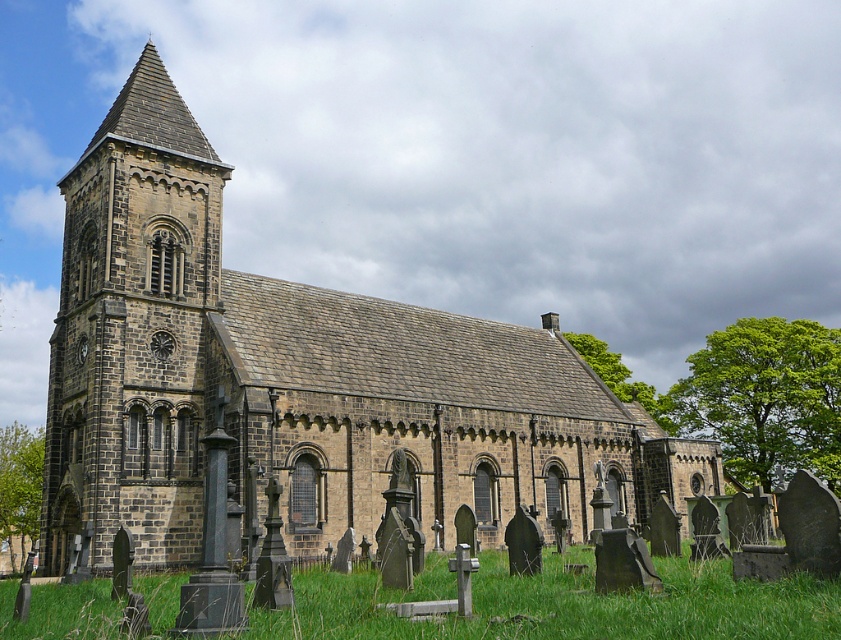
You are standing in the graveyard in front of the historic stone church. You notice a point marked at coordinates (295, 378). Based on the church and graveyard layout, what significant structure does this point most likely indicate?

The point at coordinates (295, 378) corresponds to the brown stone church at center, which is the main structure in the scene.

You are a landscape architect evaluating the church grounds. You need to assess whether the dark gray stone tower at left can be seen from the green grass at lower center without obstruction. Based on their sizes, can you determine if the tower will block the view?

The dark gray stone tower at left is larger in size than green grass at lower center. Since the tower is larger, it may obstruct the view from the grass area depending on its height and proximity. However, the size alone doesn not guarantee obstruction without considering elevation differences. Further analysis of height and distance between them is needed.

You are standing in the graveyard in front of the church. You want to walk straight towards the dark gray stone tower at left. How far will you have to walk to reach it?

The dark gray stone tower at left is 152.50 feet away from you, so you will have to walk 152.50 feet to reach it.